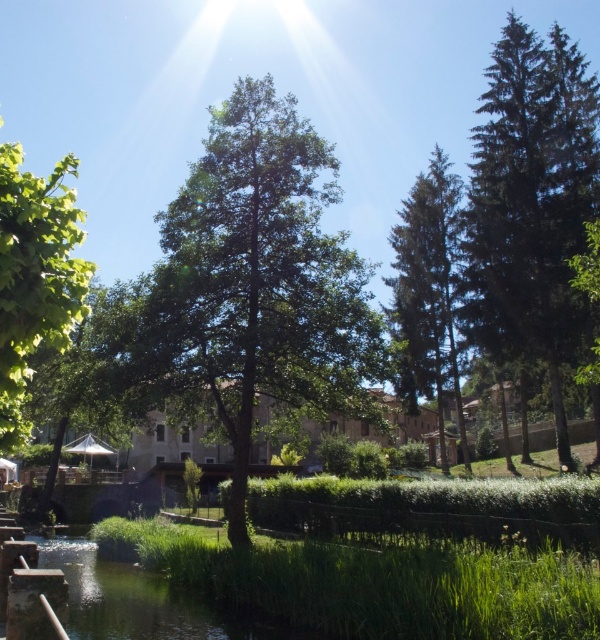
Question: Based on their relative distances, which object is nearer to the green textured pine tree at upper right?

Choices:
 (A) green leafy tree at left
 (B) green leafy tree at center

Answer: (B)

Question: Which point is closer to the camera taking this photo?

Choices:
 (A) (247, 456)
 (B) (54, 292)

Answer: (B)

Question: Can you confirm if green leafy tree at center is positioned above dark green coniferous tree at right?

Choices:
 (A) no
 (B) yes

Answer: (A)

Question: Which point is farther to the camera?

Choices:
 (A) green leafy tree at left
 (B) green leafy tree at center
 (C) green textured pine tree at upper right
 (D) dark green coniferous tree at right

Answer: (C)

Question: Considering the relative positions of green leafy tree at center and green textured pine tree at upper right in the image provided, where is green leafy tree at center located with respect to green textured pine tree at upper right?

Choices:
 (A) left
 (B) right

Answer: (A)

Question: Is green leafy tree at left to the left of green textured pine tree at upper right from the viewer's perspective?

Choices:
 (A) yes
 (B) no

Answer: (A)